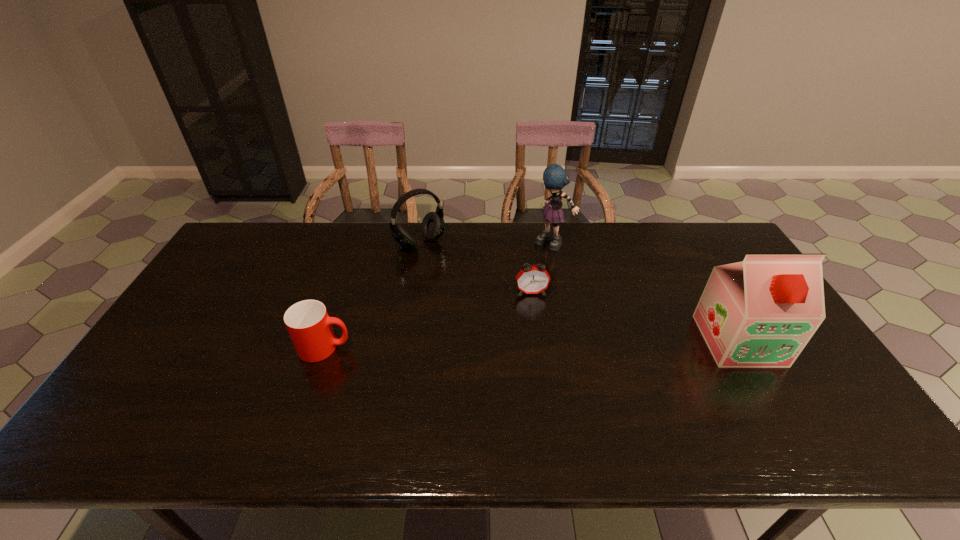
In order to click on free space between the rag doll and the third shortest object in this screenshot , I will do `click(486, 244)`.

Where is `empty location between the rag doll and the soya milk`? This screenshot has height=540, width=960. empty location between the rag doll and the soya milk is located at coordinates (645, 292).

Where is `unoccupied area between the soya milk and the rag doll`? Image resolution: width=960 pixels, height=540 pixels. unoccupied area between the soya milk and the rag doll is located at coordinates (645, 292).

The height and width of the screenshot is (540, 960). I want to click on free space that is in between the rag doll and the cup, so click(439, 296).

I want to click on free space between the rag doll and the third tallest object, so click(486, 244).

Identify the location of object that is the third closest to the fourth object from right to left. (308, 323).

Find the location of `object that stands as the third closest to the leftmost object`. object that stands as the third closest to the leftmost object is located at coordinates (555, 178).